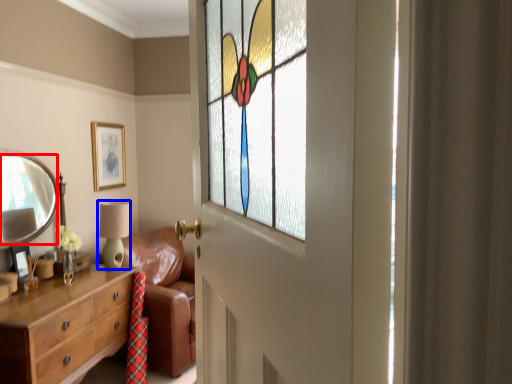
Question: Which point is further to the camera, mirror (highlighted by a red box) or table lamp (highlighted by a blue box)?

Choices:
 (A) mirror
 (B) table lamp

Answer: (B)